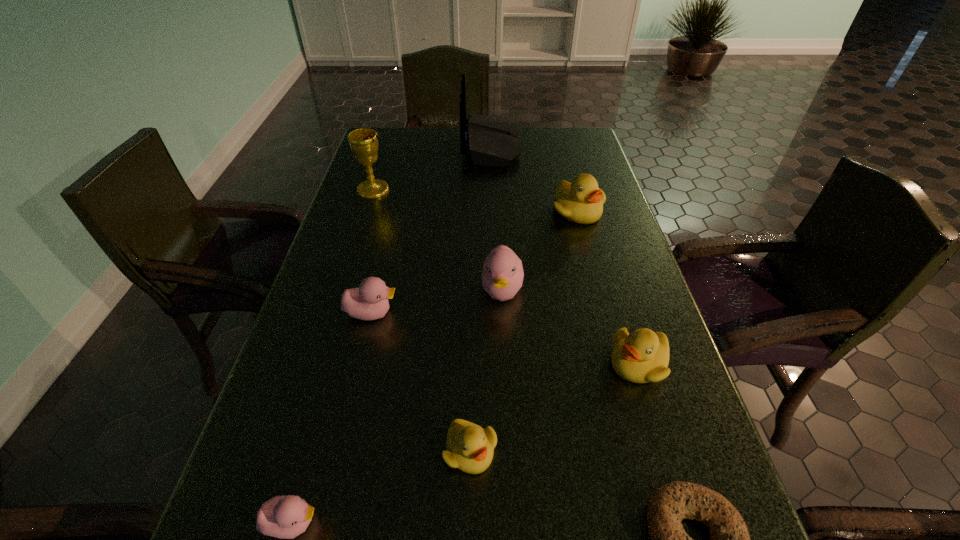
This screenshot has width=960, height=540. Identify the location of vacant space in between the gold chalice and the leftmost yellow duckling. (421, 320).

Identify the location of free space between the biggest yellow duckling and the chalice. The height and width of the screenshot is (540, 960). (475, 200).

Identify the location of free spot between the black router and the biggest pink duckling. The image size is (960, 540). (x=497, y=218).

Identify the location of the third closest object to the biggest yellow duckling. The image size is (960, 540). (642, 356).

Where is `object that is the closest to the nearest pink duckling`? This screenshot has height=540, width=960. object that is the closest to the nearest pink duckling is located at coordinates (470, 448).

Locate which duckling ranks in proximity to the smallest yellow duckling. Please provide its 2D coordinates. Your answer should be formatted as a tuple, i.e. [(x, y)], where the tuple contains the x and y coordinates of a point satisfying the conditions above.

[(285, 517)]

Identify which duckling is the sixth nearest to the chalice. Please provide its 2D coordinates. Your answer should be formatted as a tuple, i.e. [(x, y)], where the tuple contains the x and y coordinates of a point satisfying the conditions above.

[(285, 517)]

Identify which pink duckling is the nearest to the fourth nearest object. Please provide its 2D coordinates. Your answer should be formatted as a tuple, i.e. [(x, y)], where the tuple contains the x and y coordinates of a point satisfying the conditions above.

[(502, 276)]

Locate an element on the screen. The image size is (960, 540). pink duckling that is the third closest one to the black router is located at coordinates (285, 517).

Locate which yellow duckling ranks in proximity to the biggest yellow duckling. Please provide its 2D coordinates. Your answer should be formatted as a tuple, i.e. [(x, y)], where the tuple contains the x and y coordinates of a point satisfying the conditions above.

[(642, 356)]